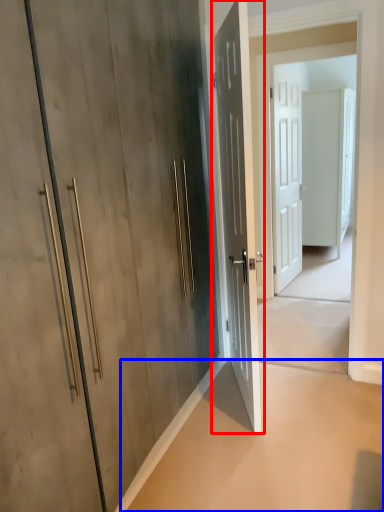
Question: Which object is closer to the camera taking this photo, door (highlighted by a red box) or concrete (highlighted by a blue box)?

Choices:
 (A) door
 (B) concrete

Answer: (B)